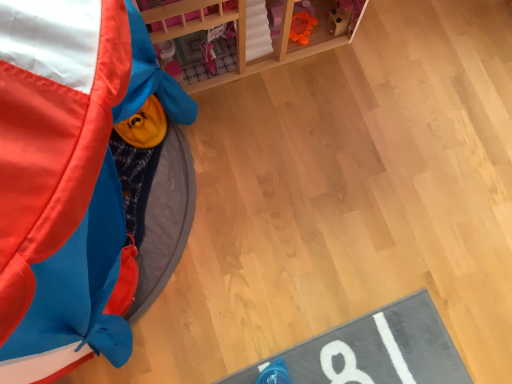
What is the approximate height of rubberized yellow toy at upper left?

The height of rubberized yellow toy at upper left is 33.57 inches.

What do you see at coordinates (67, 177) in the screenshot? The width and height of the screenshot is (512, 384). I see `rubberized yellow toy at upper left` at bounding box center [67, 177].

The width and height of the screenshot is (512, 384). In order to click on rubberized yellow toy at upper left in this screenshot , I will do `click(67, 177)`.

Identify the location of wooden dollhouse at upper center. (245, 34).

What do you see at coordinates (245, 34) in the screenshot? I see `wooden dollhouse at upper center` at bounding box center [245, 34].

Identify the location of rubberized yellow toy at upper left. (67, 177).

Based on their positions, is rubberized yellow toy at upper left located to the left or right of wooden dollhouse at upper center?

From the image, it's evident that rubberized yellow toy at upper left is to the left of wooden dollhouse at upper center.

In the image, is rubberized yellow toy at upper left positioned in front of or behind wooden dollhouse at upper center?

Clearly, rubberized yellow toy at upper left is in front of wooden dollhouse at upper center.

Is point (106, 215) positioned after point (300, 48)?

No.

Looking at this image, from the image's perspective, is rubberized yellow toy at upper left positioned above or below wooden dollhouse at upper center?

rubberized yellow toy at upper left is situated lower than wooden dollhouse at upper center in the image.

From a real-world perspective, relative to wooden dollhouse at upper center, is rubberized yellow toy at upper left vertically above or below?

From a real-world perspective, rubberized yellow toy at upper left is physically above wooden dollhouse at upper center.

In terms of width, does rubberized yellow toy at upper left look wider or thinner when compared to wooden dollhouse at upper center?

Clearly, rubberized yellow toy at upper left has more width compared to wooden dollhouse at upper center.

Considering the relative sizes of rubberized yellow toy at upper left and wooden dollhouse at upper center in the image provided, is rubberized yellow toy at upper left shorter than wooden dollhouse at upper center?

No.

Based on their sizes in the image, would you say rubberized yellow toy at upper left is bigger or smaller than wooden dollhouse at upper center?

Considering their sizes, rubberized yellow toy at upper left takes up more space than wooden dollhouse at upper center.

Can we say rubberized yellow toy at upper left lies outside wooden dollhouse at upper center?

Yes, rubberized yellow toy at upper left is outside of wooden dollhouse at upper center.

From the picture: Is rubberized yellow toy at upper left not near wooden dollhouse at upper center?

No, there isn't a large distance between rubberized yellow toy at upper left and wooden dollhouse at upper center.

Is rubberized yellow toy at upper left looking in the opposite direction of wooden dollhouse at upper center?

No, rubberized yellow toy at upper left is not facing the opposite direction of wooden dollhouse at upper center.

How much distance is there between rubberized yellow toy at upper left and wooden dollhouse at upper center?

rubberized yellow toy at upper left and wooden dollhouse at upper center are 45.75 centimeters apart.

The height and width of the screenshot is (384, 512). What are the coordinates of `toy that appears in front of the wooden dollhouse at upper center` in the screenshot? It's located at (67, 177).

Would you say wooden dollhouse at upper center is to the left or to the right of rubberized yellow toy at upper left in the picture?

From the image, it's evident that wooden dollhouse at upper center is to the right of rubberized yellow toy at upper left.

Is the position of wooden dollhouse at upper center less distant than that of rubberized yellow toy at upper left?

That is False.

Which is closer, (329, 4) or (98, 250)?

Point (329, 4) is positioned farther from the camera compared to point (98, 250).

From the image's perspective, who appears lower, wooden dollhouse at upper center or rubberized yellow toy at upper left?

rubberized yellow toy at upper left.

From a real-world perspective, between wooden dollhouse at upper center and rubberized yellow toy at upper left, who is vertically lower?

wooden dollhouse at upper center is physically lower.

Looking at their sizes, would you say wooden dollhouse at upper center is wider or thinner than rubberized yellow toy at upper left?

Considering their sizes, wooden dollhouse at upper center looks slimmer than rubberized yellow toy at upper left.

Can you confirm if wooden dollhouse at upper center is shorter than rubberized yellow toy at upper left?

Correct, wooden dollhouse at upper center is not as tall as rubberized yellow toy at upper left.

Considering the relative sizes of wooden dollhouse at upper center and rubberized yellow toy at upper left in the image provided, is wooden dollhouse at upper center bigger than rubberized yellow toy at upper left?

Incorrect, wooden dollhouse at upper center is not larger than rubberized yellow toy at upper left.

Is wooden dollhouse at upper center surrounding rubberized yellow toy at upper left?

Actually, rubberized yellow toy at upper left is outside wooden dollhouse at upper center.

Is wooden dollhouse at upper center placed right next to rubberized yellow toy at upper left?

wooden dollhouse at upper center is not next to rubberized yellow toy at upper left, and they're not touching.

Is wooden dollhouse at upper center turned away from rubberized yellow toy at upper left?

No, wooden dollhouse at upper center is not facing away from rubberized yellow toy at upper left.

How many degrees apart are the facing directions of wooden dollhouse at upper center and rubberized yellow toy at upper left?

They differ by 49.4 degrees in their facing directions.

Measure the distance between wooden dollhouse at upper center and rubberized yellow toy at upper left.

A distance of 18.01 inches exists between wooden dollhouse at upper center and rubberized yellow toy at upper left.

Where is `furniture behind the rubberized yellow toy at upper left`? The height and width of the screenshot is (384, 512). furniture behind the rubberized yellow toy at upper left is located at coordinates (245, 34).

Find the location of a particular element. The image size is (512, 384). toy in front of the wooden dollhouse at upper center is located at coordinates (67, 177).

Locate an element on the screen. furniture behind the rubberized yellow toy at upper left is located at coordinates (245, 34).